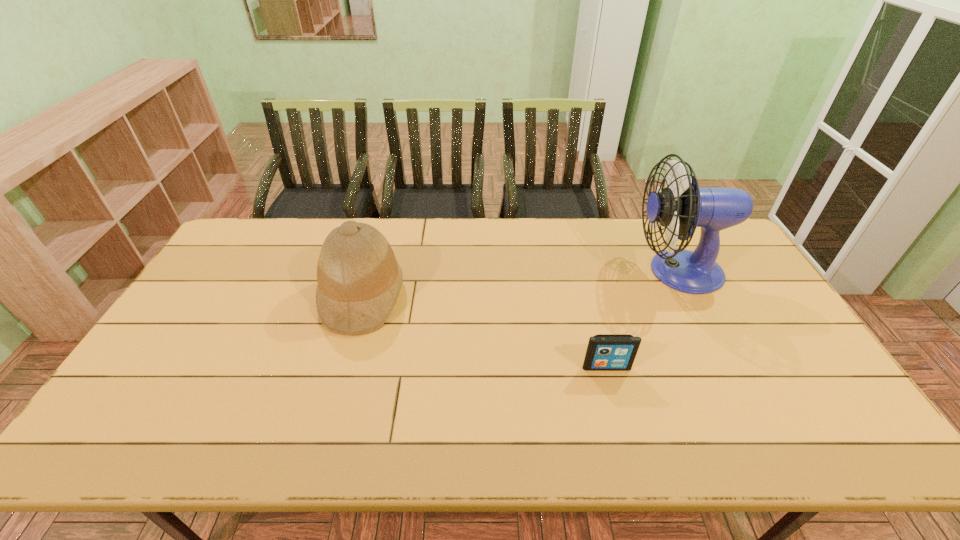
Find the location of a particular element. This screenshot has width=960, height=540. the rightmost object is located at coordinates (680, 207).

Locate an element on the screen. The image size is (960, 540). the tallest object is located at coordinates (680, 207).

Find the location of a particular element. the leftmost object is located at coordinates (359, 279).

Locate an element on the screen. the second tallest object is located at coordinates (359, 279).

Locate an element on the screen. The image size is (960, 540). iPod is located at coordinates pyautogui.click(x=605, y=352).

At what (x,y) coordinates should I click in order to perform the action: click on the second object from right to left. Please return your answer as a coordinate pair (x, y). Looking at the image, I should click on (605, 352).

This screenshot has height=540, width=960. In order to click on free space located in front of the tallest object where the airflow is directed in this screenshot , I will do `click(578, 271)`.

Locate an element on the screen. free space located 0.230m in front of the tallest object where the airflow is directed is located at coordinates (563, 271).

Where is `vacant point located in front of the tallest object where the airflow is directed`? Image resolution: width=960 pixels, height=540 pixels. vacant point located in front of the tallest object where the airflow is directed is located at coordinates (519, 271).

Identify the location of free location located 0.090m on the front-facing side of the leftmost object. (433, 296).